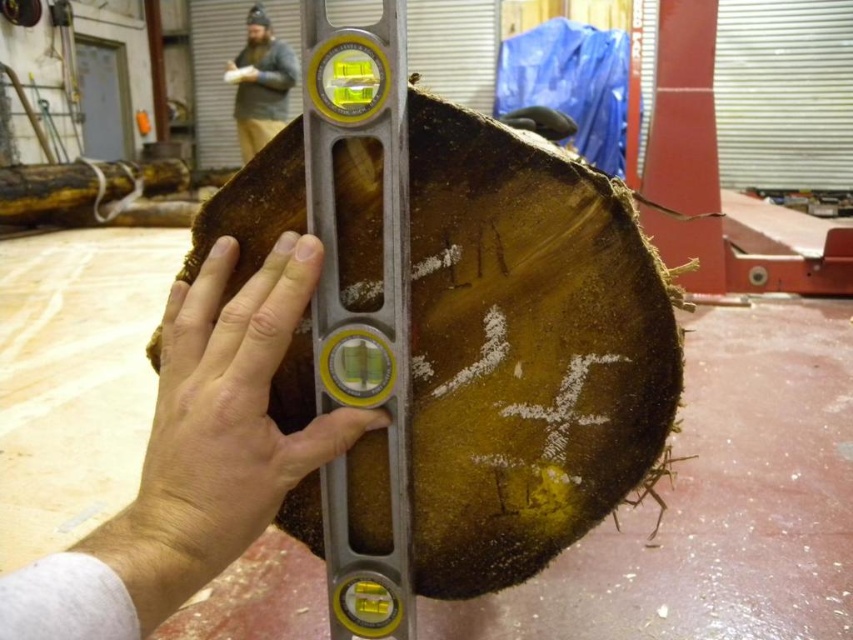
Who is higher up, brown rough wood at center or bearded man at upper left?

bearded man at upper left

Does brown rough wood at center have a lesser width compared to bearded man at upper left?

Correct, brown rough wood at center's width is less than bearded man at upper left's.

Which is in front, point (210, 547) or point (245, 76)?

Point (210, 547) is in front.

The width and height of the screenshot is (853, 640). What are the coordinates of `brown rough wood at center` in the screenshot? It's located at (231, 404).